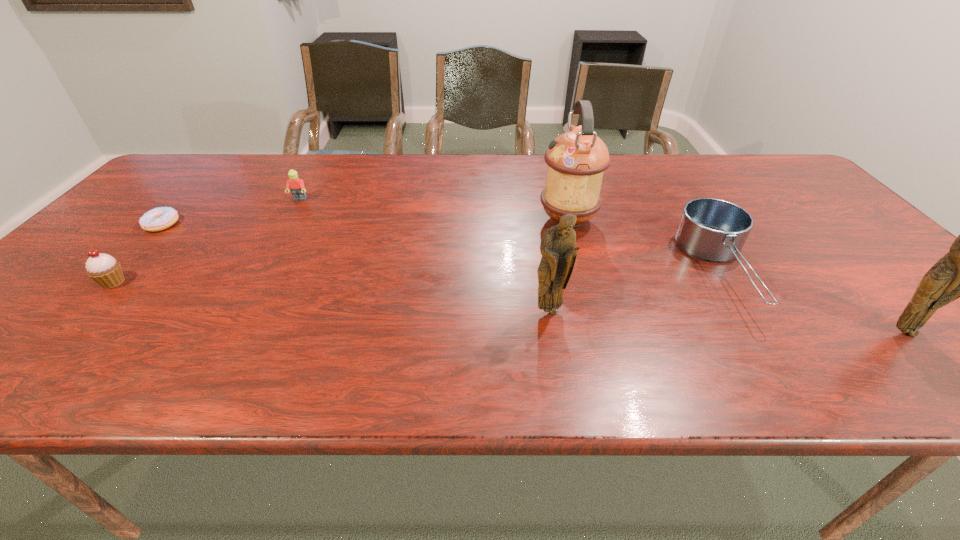
At what (x,y) coordinates should I click in order to perform the action: click on free space at the near edge. Please return your answer as a coordinate pair (x, y). This screenshot has height=540, width=960. Looking at the image, I should click on (731, 337).

This screenshot has height=540, width=960. In order to click on vacant space at the left edge of the desktop in this screenshot , I will do pos(192,193).

Locate an element on the screen. The image size is (960, 540). vacant area at the right edge is located at coordinates (791, 204).

At what (x,y) coordinates should I click in order to perform the action: click on vacant space at the far right corner of the desktop. Please return your answer as a coordinate pair (x, y). Looking at the image, I should click on (780, 173).

You are a GUI agent. You are given a task and a screenshot of the screen. Output one action in this format:
    pyautogui.click(x=<x>, y=<y>)
    Task: Click on the free space between the second object from right to left and the cupcake
    Image resolution: width=960 pixels, height=540 pixels.
    Given the screenshot: What is the action you would take?
    pyautogui.click(x=419, y=276)

The image size is (960, 540). Find the location of `free point between the doughnut and the farther figurine`. free point between the doughnut and the farther figurine is located at coordinates (355, 267).

You are a GUI agent. You are given a task and a screenshot of the screen. Output one action in this format:
    pyautogui.click(x=<x>, y=<y>)
    Task: Click on the vacant area between the oil lamp and the taller figurine
    
    Given the screenshot: What is the action you would take?
    pyautogui.click(x=735, y=275)

Find the location of a particular element. The width and height of the screenshot is (960, 540). free spot between the cupcake and the oil lamp is located at coordinates (341, 251).

This screenshot has width=960, height=540. Identify the location of vacant area that lies between the farthest object and the shorter figurine. (424, 255).

Locate an element on the screen. The height and width of the screenshot is (540, 960). free space between the shortest object and the right figurine is located at coordinates (533, 278).